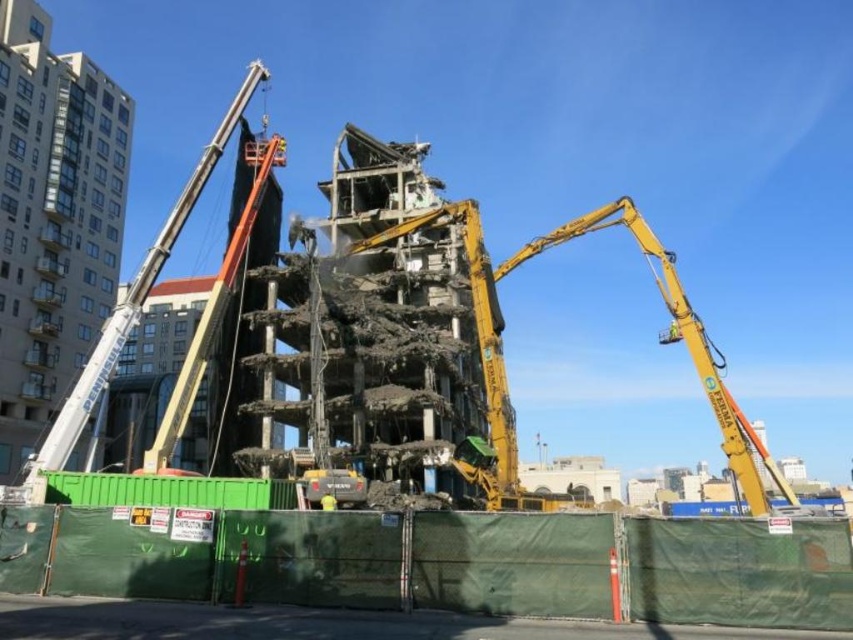
You are a safety inspector standing at the back of the demolition site. You need to ensure that the orange metallic crane at left and the yellow fabric construction worker at center are visible from your current position. Which object is easier to see from your vantage point?

The orange metallic crane at left is much taller than the yellow fabric construction worker at center, so it is easier to see from the back of the demolition site.

You are a construction worker standing at the green construction fence. You need to place a new safety sign between the two points marked as point (167, 246) and point (329, 490). Based on their positions, which point is closer to you so that you can reach it without crossing the other point?

Point (329, 490) is closer to you because point (167, 246) is behind it, so you can reach point (329, 490) first without crossing the other point.

You are a safety inspector at the demolition site. You need to ensure that the yellow metallic arm at center does not accidentally crush the yellow fabric construction worker at center. Based on the scene description, can you confirm if there is enough space between them to prevent this?

The yellow metallic arm at center has a larger width than the yellow fabric construction worker at center, so there is sufficient space between them to prevent crushing.